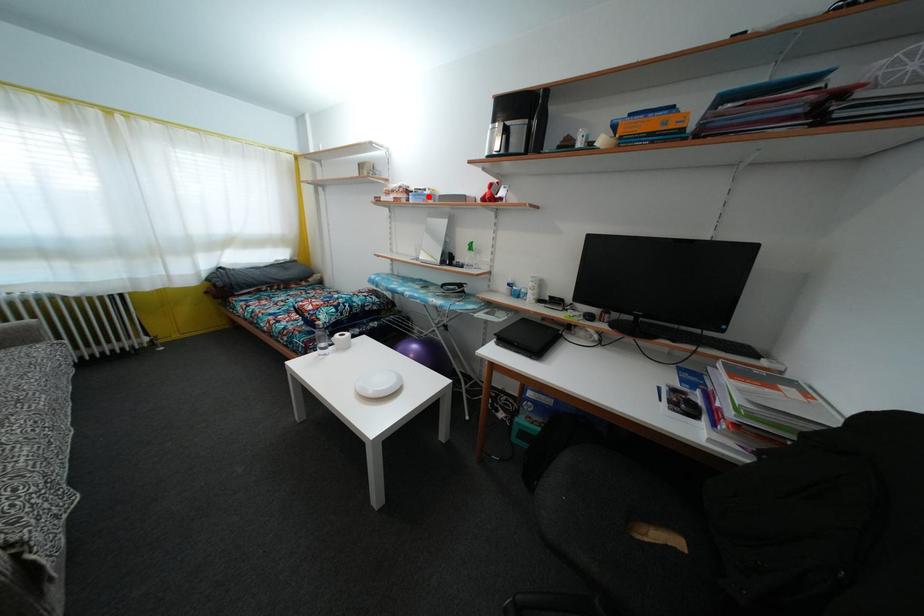
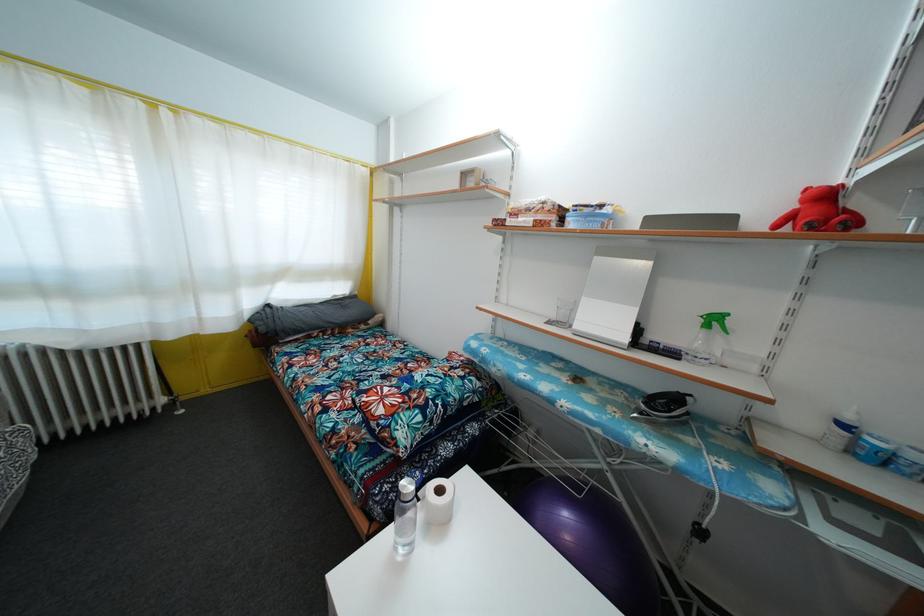
Locate, in the second image, the point that corresponds to the highlighted location in the first image.

(605, 213)